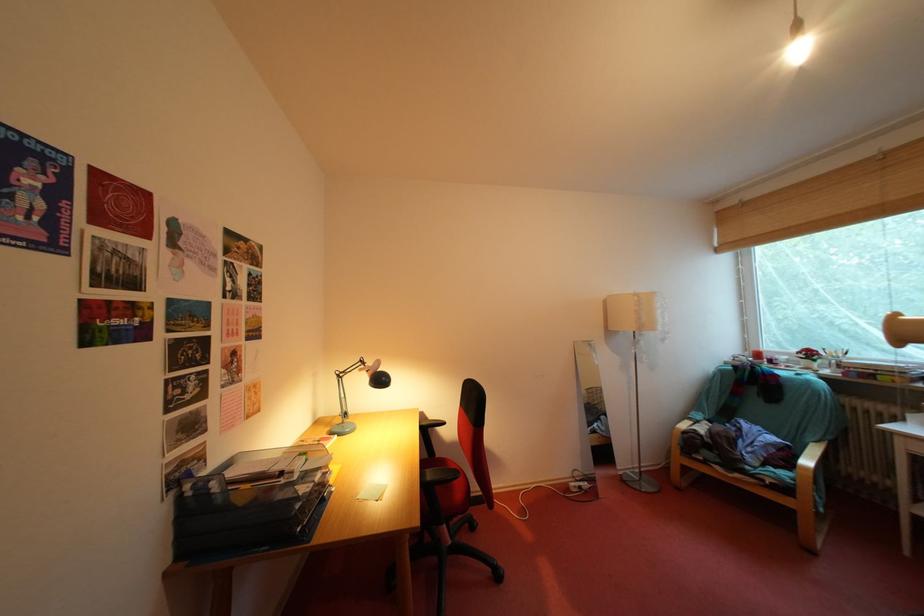
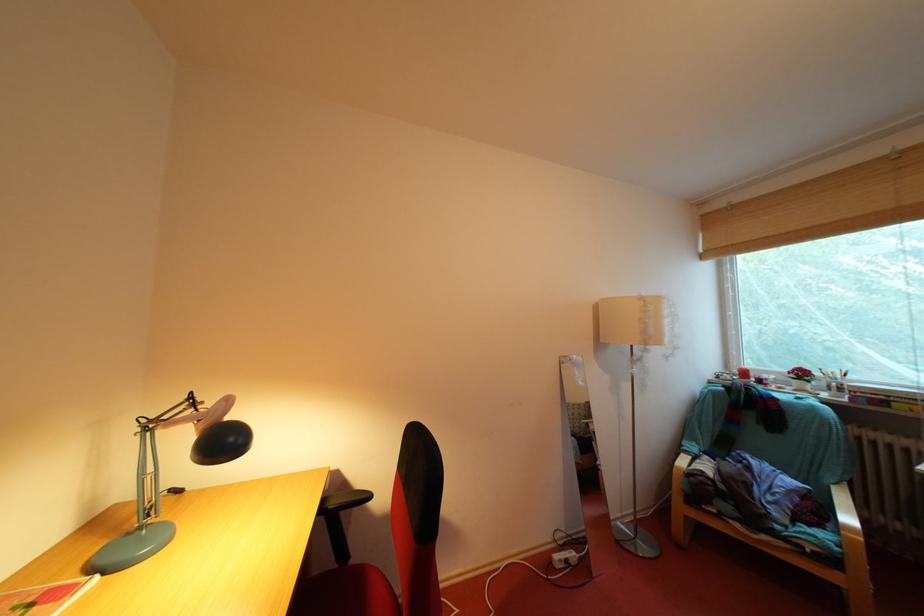
Where in the second image is the point corresponding to pixel 434 429 from the first image?

(342, 508)